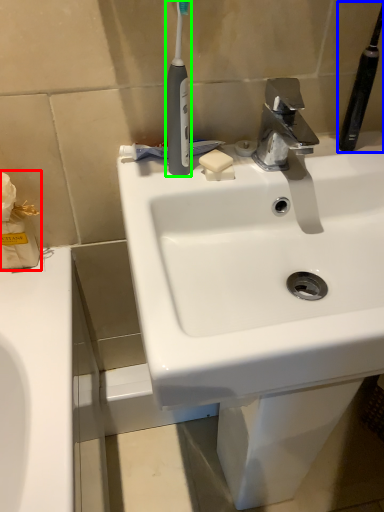
Question: Considering the real-world distances, which object is farthest from tissue (highlighted by a red box)? toothbrush (highlighted by a blue box) or toothbrush (highlighted by a green box)?

Choices:
 (A) toothbrush
 (B) toothbrush

Answer: (A)